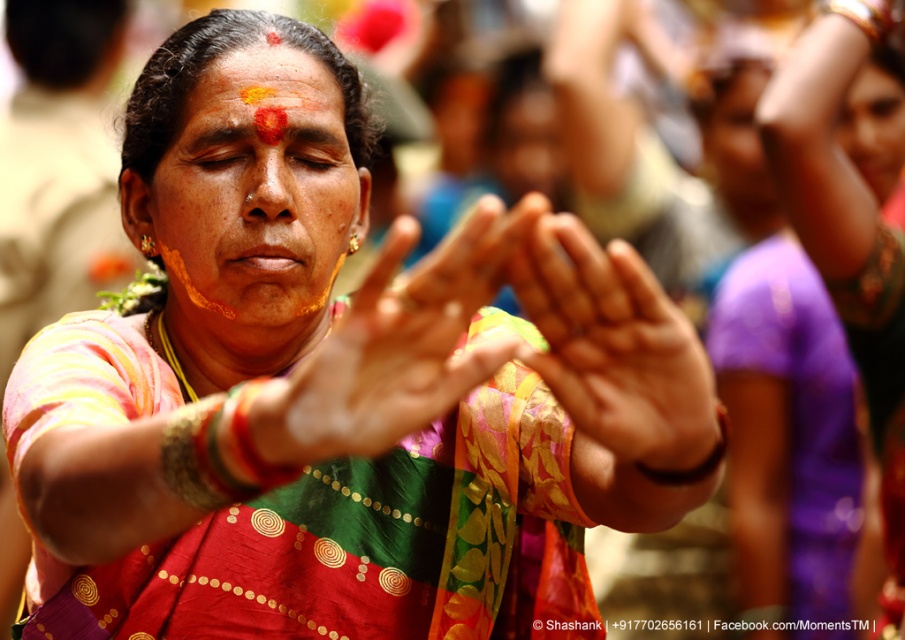
You are standing in the crowd at this cultural event and want to take a photo of the central figure. If you are 2 meters away from the point marked at coordinates point (882, 605), will you be able to capture the central figure clearly in your photo?

The distance of point (882, 605) from viewer is 2.26 meters. Since you are 2 meters away from this point, you are closer than the point itself, meaning you can still capture the central figure clearly in your photo.

You are a photographer trying to capture a closeup of the smooth skin face at upper right. However, the matte fabric hands at center are blocking your view. Can you adjust your camera angle to see the face without moving any objects?

The matte fabric hands at center are in front of the smooth skin face at upper right, so adjusting the camera angle might allow you to see around or above the hands to capture the face without moving anything.